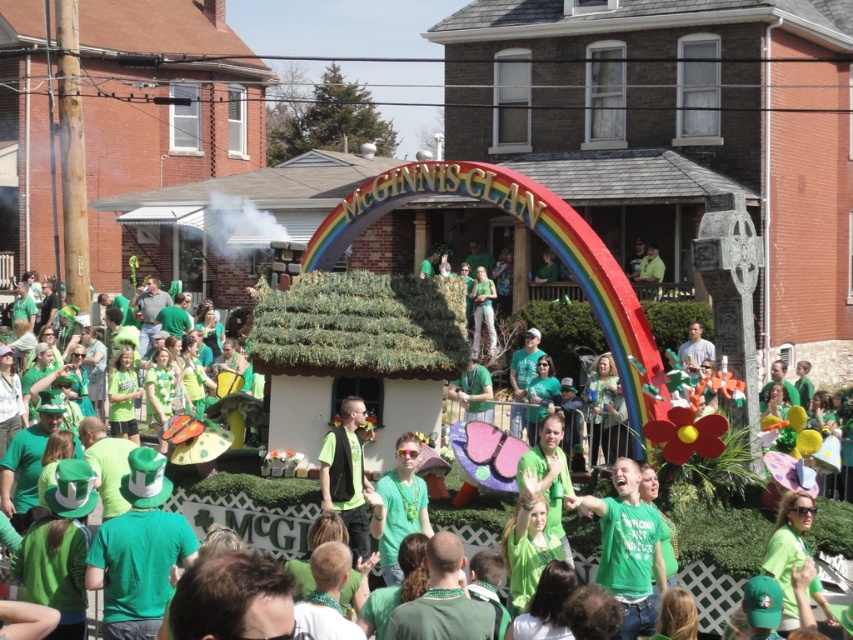
Question: Considering the real-world distances, which object is farthest from the green matte vest at center?

Choices:
 (A) matte green float at center
 (B) green matte shirt at center

Answer: (B)

Question: Which is farther from the matte green float at center?

Choices:
 (A) green matte vest at center
 (B) green matte shirt at center

Answer: (B)

Question: Does matte green float at center appear on the left side of green matte shirt at center?

Choices:
 (A) yes
 (B) no

Answer: (A)

Question: Is matte green float at center positioned before green matte shirt at center?

Choices:
 (A) no
 (B) yes

Answer: (A)

Question: Which of the following is the farthest from the observer?

Choices:
 (A) green matte vest at center
 (B) matte green float at center

Answer: (A)

Question: Is matte green float at center wider than green matte vest at center?

Choices:
 (A) yes
 (B) no

Answer: (A)